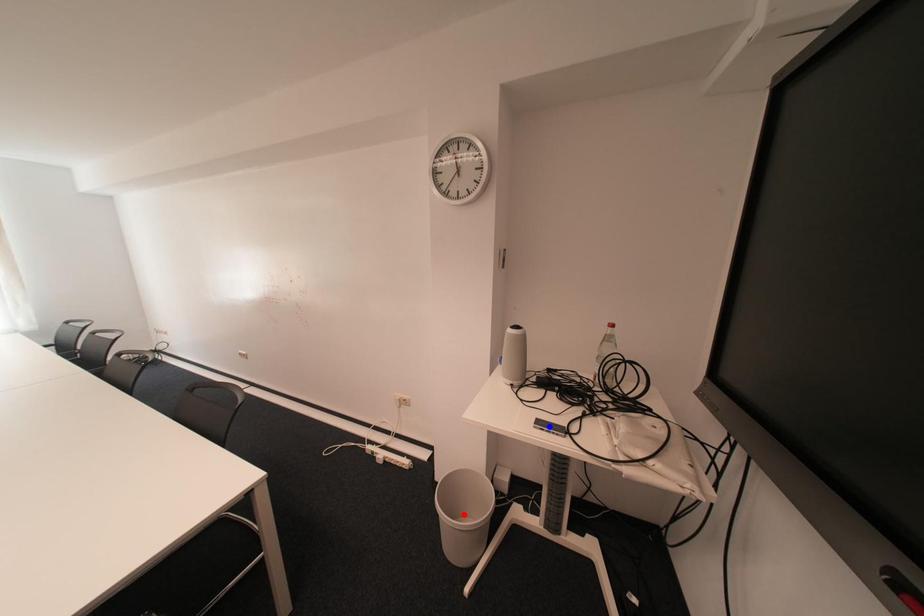
Question: Which of the two points in the image is closer to the camera?

Choices:
 (A) Blue point is closer.
 (B) Red point is closer.

Answer: (A)